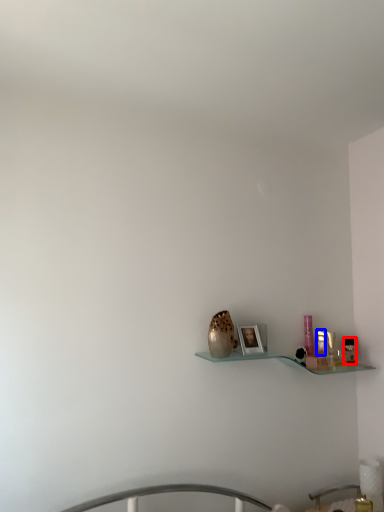
Question: Which of the following is the farthest to the observer, toiletry (highlighted by a red box) or toiletry (highlighted by a blue box)?

Choices:
 (A) toiletry
 (B) toiletry

Answer: (A)